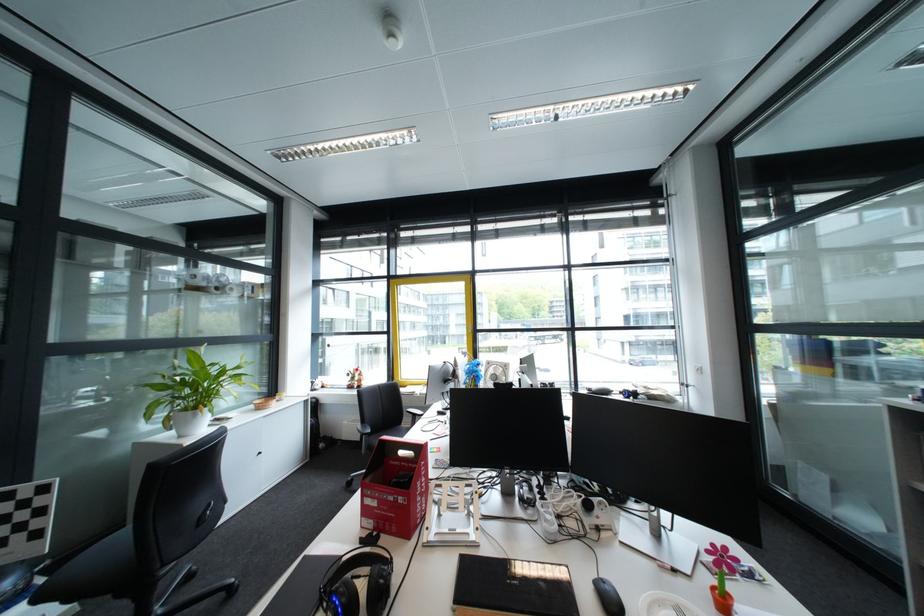
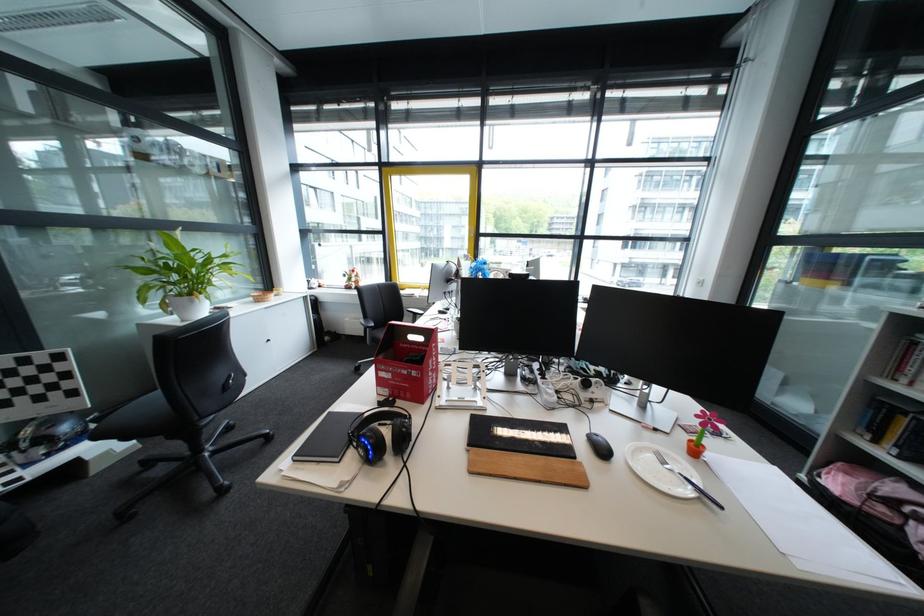
Locate, in the second image, the point that corresponds to (x=606, y=588) in the first image.

(600, 439)